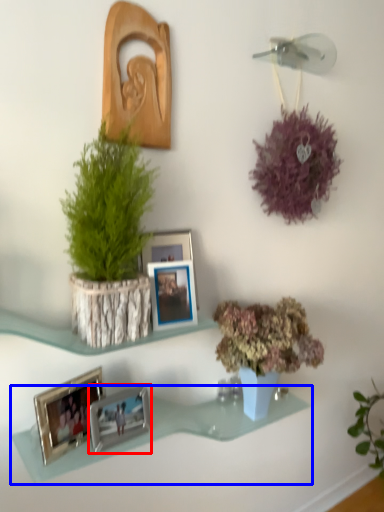
Question: Which of the following is the closest to the observer, picture frame (highlighted by a red box) or shelf (highlighted by a blue box)?

Choices:
 (A) picture frame
 (B) shelf

Answer: (B)